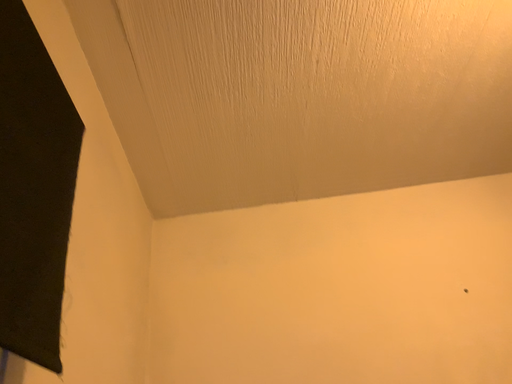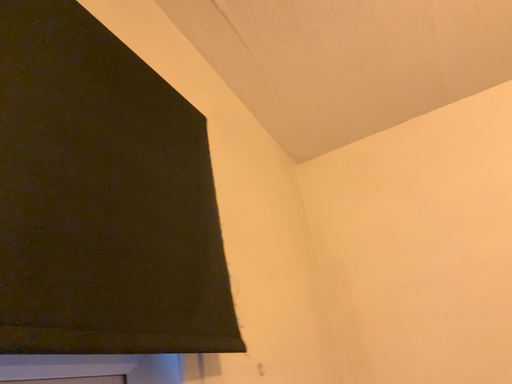
Question: How did the camera likely rotate when shooting the video?

Choices:
 (A) rotated upward
 (B) rotated downward

Answer: (B)